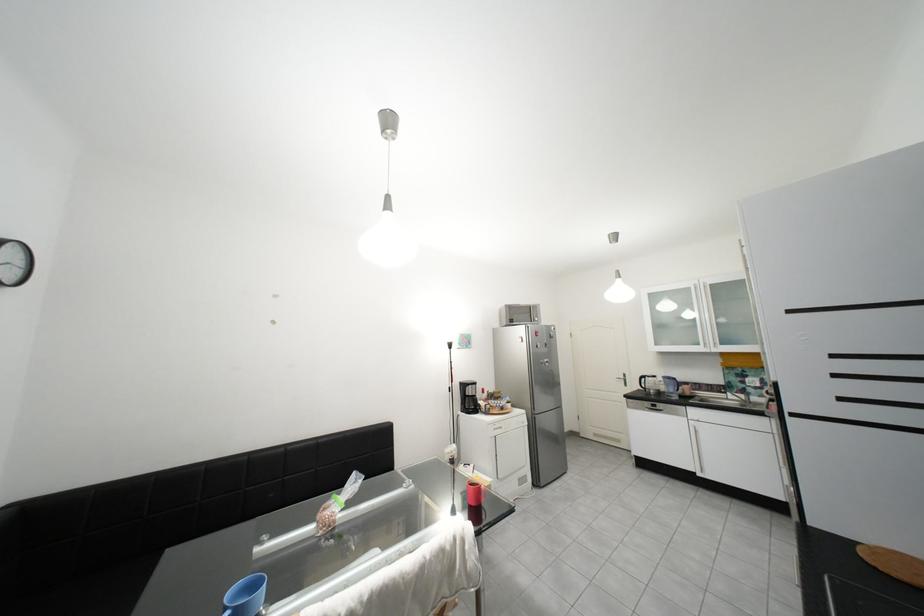
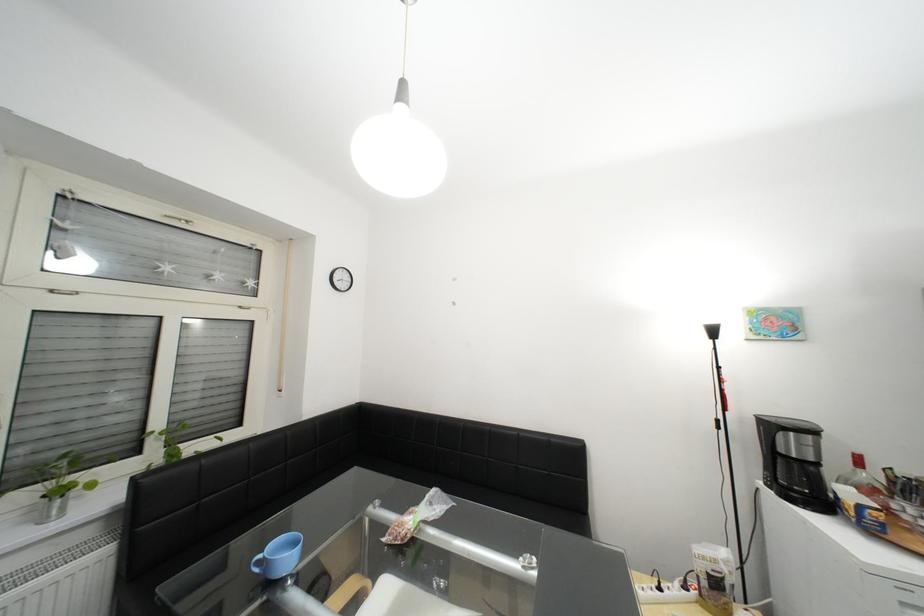
The point at (x=499, y=415) is marked in the first image. Where is the corresponding point in the second image?

(886, 533)